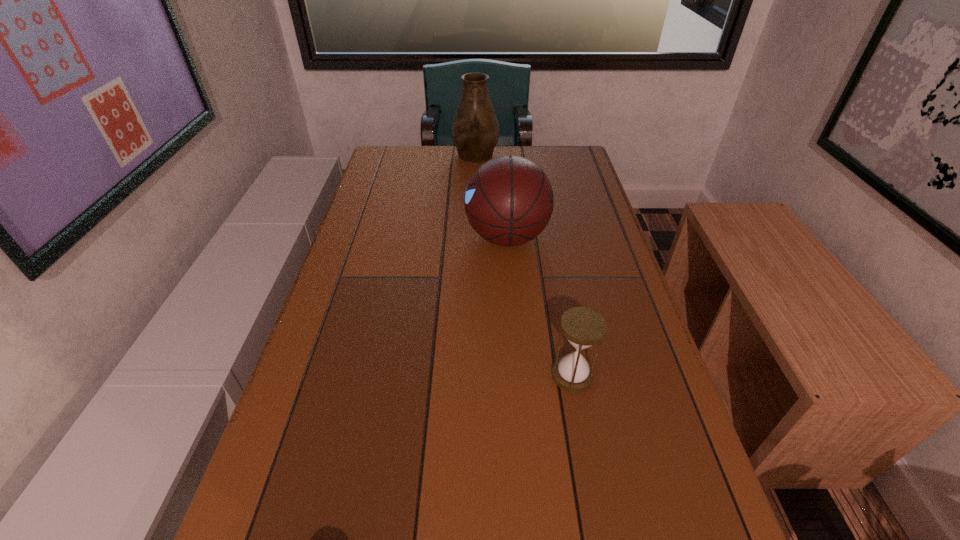
Identify the location of object located in the right edge section of the desktop. (583, 327).

The image size is (960, 540). I want to click on blank space at the far edge of the desktop, so click(x=421, y=168).

At what (x,y) coordinates should I click in order to perform the action: click on vacant space at the left edge of the desktop. Please return your answer as a coordinate pair (x, y). The image size is (960, 540). Looking at the image, I should click on (349, 254).

Where is `vacant space at the right edge of the desktop`? The height and width of the screenshot is (540, 960). vacant space at the right edge of the desktop is located at coordinates (599, 238).

Identify the location of free space at the far left corner of the desktop. (401, 154).

Find the location of a particular element. This screenshot has width=960, height=540. free space between the pitcher and the nearest object is located at coordinates (524, 266).

At what (x,y) coordinates should I click in order to perform the action: click on free spot between the nearest object and the second tallest object. Please return your answer as a coordinate pair (x, y). Image resolution: width=960 pixels, height=540 pixels. Looking at the image, I should click on pos(540,306).

Find the location of a particular element. The image size is (960, 540). vacant area that lies between the farthest object and the nearest object is located at coordinates (524, 266).

This screenshot has height=540, width=960. Find the location of `free spot between the tallest object and the shortest object`. free spot between the tallest object and the shortest object is located at coordinates (524, 266).

The width and height of the screenshot is (960, 540). I want to click on object that is the closest to the tallest object, so click(x=509, y=200).